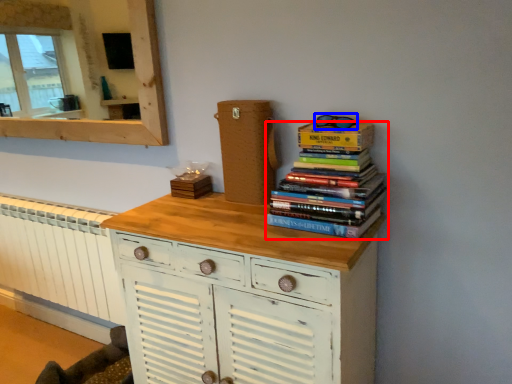
Question: Which object appears closest to the camera in this image, book (highlighted by a red box) or goggles (highlighted by a blue box)?

Choices:
 (A) book
 (B) goggles

Answer: (A)